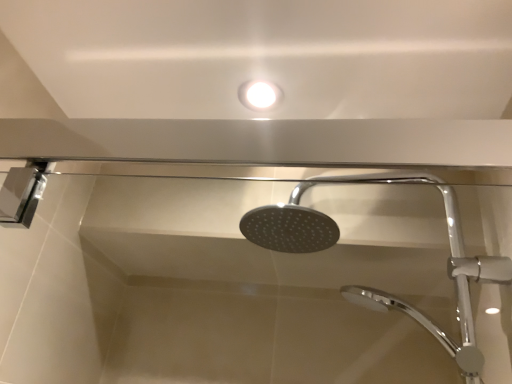
Measure the distance between white glossy light fixture at upper center and camera.

The depth of white glossy light fixture at upper center is 30.96 inches.

The height and width of the screenshot is (384, 512). What do you see at coordinates (259, 94) in the screenshot?
I see `white glossy light fixture at upper center` at bounding box center [259, 94].

Where is `white glossy light fixture at upper center`? white glossy light fixture at upper center is located at coordinates (259, 94).

Locate an element on the screen. white glossy light fixture at upper center is located at coordinates (259, 94).